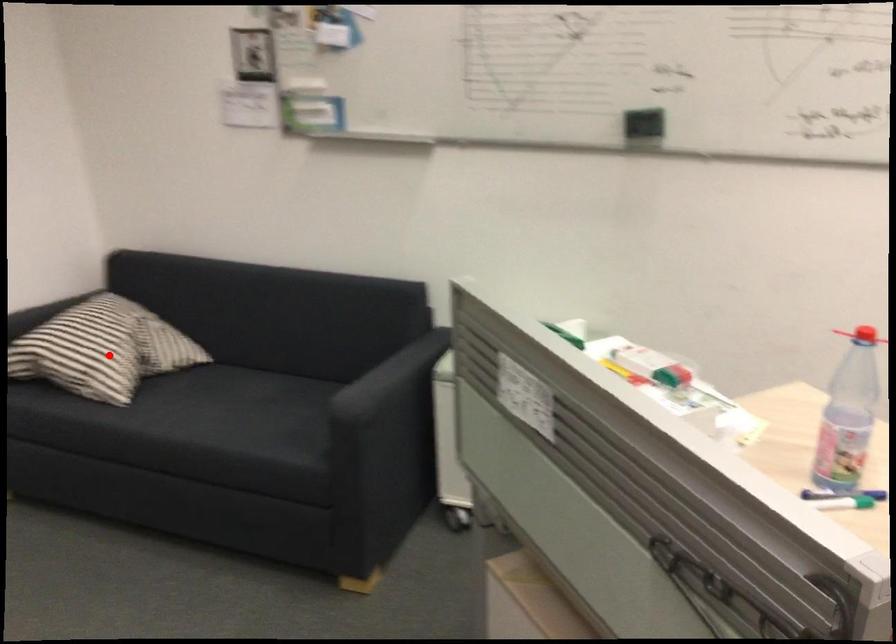
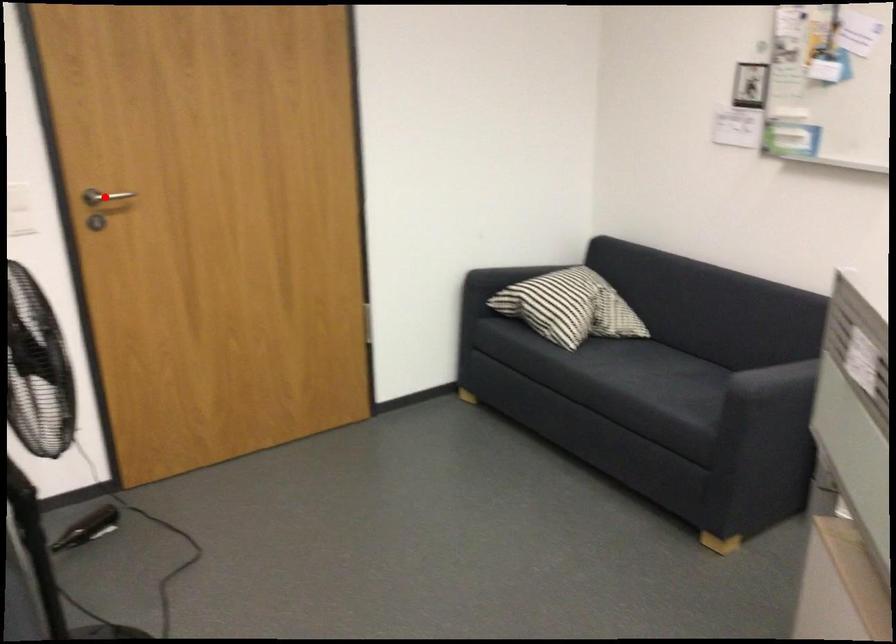
I am providing you with two images of the same scene from different viewpoints. A red point is marked on the first image and another point is marked on the second image. Is the red point in image1 aligned with the point shown in image2?

No